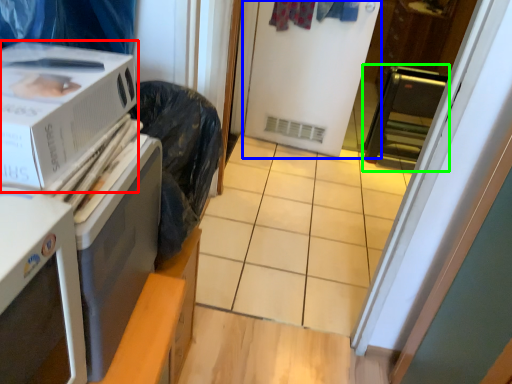
Question: Which is farther away from home appliance (highlighted by a red box)? screen door (highlighted by a blue box) or appliance (highlighted by a green box)?

Choices:
 (A) screen door
 (B) appliance

Answer: (B)